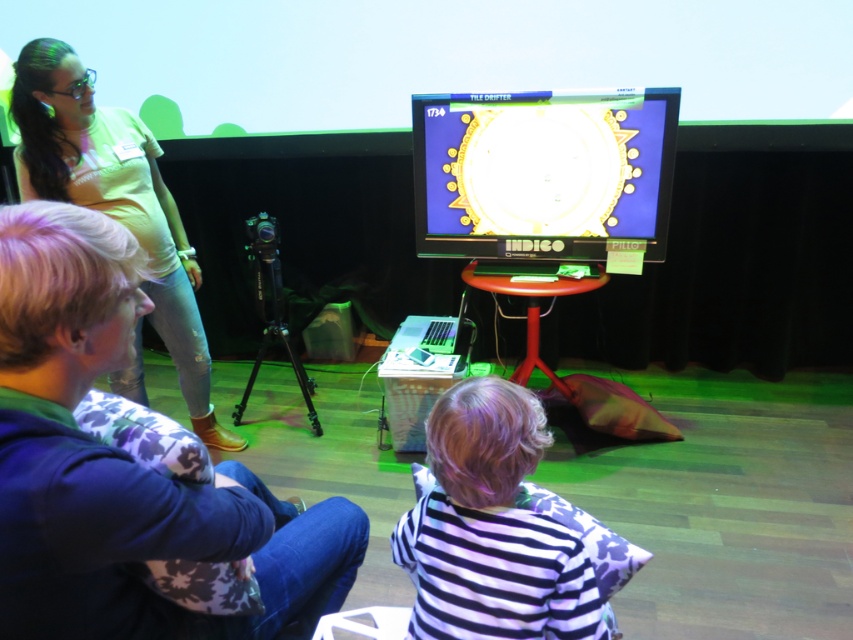
Does matte plastic monitor at center have a lesser height compared to light beige cotton shirt at upper left?

Indeed, matte plastic monitor at center has a lesser height compared to light beige cotton shirt at upper left.

Who is more distant from viewer, [456,211] or [157,227]?

The point [456,211] is more distant.

Where is `matte plastic monitor at center`? The image size is (853, 640). matte plastic monitor at center is located at coordinates (543, 172).

Which of these two, matte plastic monitor at center or striped fabric shirt at center, stands taller?

matte plastic monitor at center

At what (x,y) coordinates should I click in order to perform the action: click on matte plastic monitor at center. Please return your answer as a coordinate pair (x, y). The width and height of the screenshot is (853, 640). Looking at the image, I should click on (543, 172).

Does striped fabric shirt at center appear on the left side of light beige cotton shirt at upper left?

No, striped fabric shirt at center is not to the left of light beige cotton shirt at upper left.

Is point (601, 600) closer to viewer compared to point (74, 61)?

Yes, it is in front of point (74, 61).

At what (x,y) coordinates should I click in order to perform the action: click on striped fabric shirt at center. Please return your answer as a coordinate pair (x, y). Image resolution: width=853 pixels, height=640 pixels. Looking at the image, I should click on (491, 529).